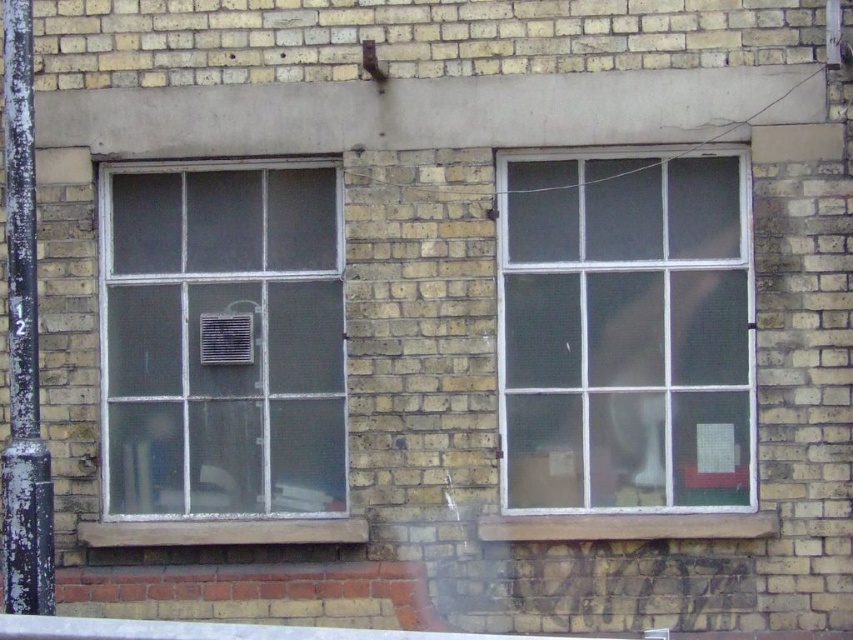
Based on the photo, is clear glass window at right behind clear glass window at left?

No, clear glass window at right is closer to the viewer.

Measure the distance between point (549, 492) and camera.

Point (549, 492) and camera are 6.49 meters apart from each other.

You are a GUI agent. You are given a task and a screenshot of the screen. Output one action in this format:
    pyautogui.click(x=<x>, y=<y>)
    Task: Click on the clear glass window at right
    This screenshot has width=853, height=640.
    Given the screenshot: What is the action you would take?
    pyautogui.click(x=624, y=330)